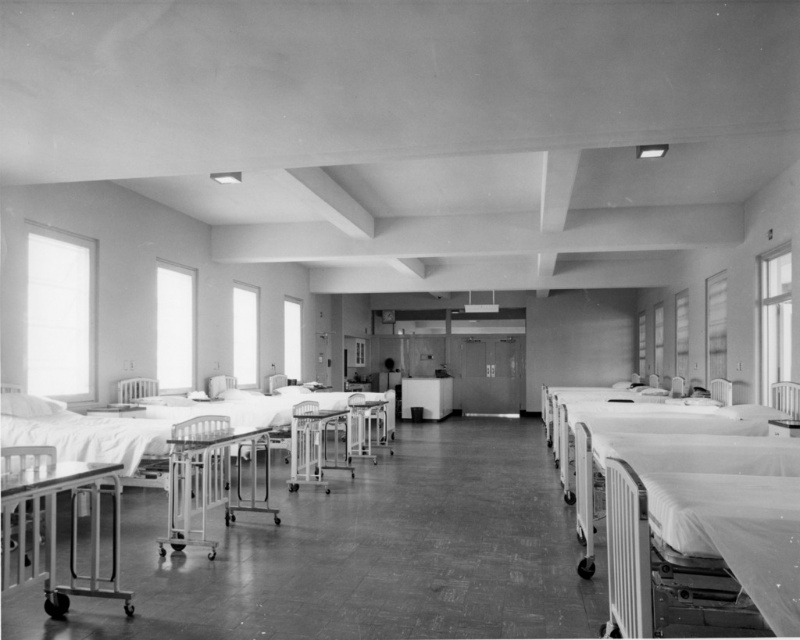
You are a nurse in the hospital ward and need to locate the white smooth bed at right. According to the coordinates provided, where would you find it?

The white smooth bed at right is located at point (694, 522).

You are a nurse in this hospital ward and need to move a medical cart from the center of the room to the area near the beds. The cart is too heavy to lift, so you must push it. Which direction should you push the cart to reach the white smooth bed at right first before reaching the metallic hospital bed at lower left?

You should push the cart towards the right side of the room because the white smooth bed at right is located above the metallic hospital bed at lower left. This means the white smooth bed at right is positioned higher up in the room, so pushing the cart towards the right will allow you to reach it before the lower positioned metallic hospital bed at lower left.

You are a nurse preparing to move a patient from one bed to another in the hospital ward. The patient requires a bed with more space due to their medical condition. Based on the scene, which bed should you choose between the white smooth bed at right and the metallic hospital bed at lower left?

The white smooth bed at right has a larger width than the metallic hospital bed at lower left, so you should choose the white smooth bed at right for the patient who needs more space.